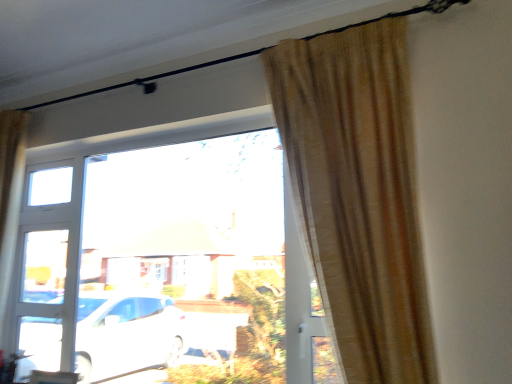
Question: Does transparent glass window at center have a smaller size compared to beige textured curtain at right?

Choices:
 (A) no
 (B) yes

Answer: (B)

Question: Can you confirm if transparent glass window at center is positioned to the right of beige textured curtain at right?

Choices:
 (A) yes
 (B) no

Answer: (B)

Question: Is transparent glass window at center at the left side of beige textured curtain at right?

Choices:
 (A) no
 (B) yes

Answer: (B)

Question: Considering the relative sizes of transparent glass window at center and beige textured curtain at right in the image provided, is transparent glass window at center taller than beige textured curtain at right?

Choices:
 (A) yes
 (B) no

Answer: (A)

Question: Can you confirm if transparent glass window at center is bigger than beige textured curtain at right?

Choices:
 (A) no
 (B) yes

Answer: (A)

Question: Is transparent glass window at center with beige textured curtain at right?

Choices:
 (A) yes
 (B) no

Answer: (B)

Question: Can we say beige textured curtain at right lies outside transparent glass window at center?

Choices:
 (A) no
 (B) yes

Answer: (B)

Question: Considering the relative sizes of beige textured curtain at right and transparent glass window at center in the image provided, is beige textured curtain at right smaller than transparent glass window at center?

Choices:
 (A) yes
 (B) no

Answer: (B)

Question: From the image's perspective, is beige textured curtain at right beneath transparent glass window at center?

Choices:
 (A) no
 (B) yes

Answer: (A)

Question: Is beige textured curtain at right positioned with its back to transparent glass window at center?

Choices:
 (A) yes
 (B) no

Answer: (B)

Question: Does beige textured curtain at right have a lesser height compared to transparent glass window at center?

Choices:
 (A) yes
 (B) no

Answer: (A)

Question: From a real-world perspective, is beige textured curtain at right located higher than transparent glass window at center?

Choices:
 (A) no
 (B) yes

Answer: (B)

Question: Looking at the image, does transparent glass window at center seem bigger or smaller compared to beige textured curtain at right?

Choices:
 (A) small
 (B) big

Answer: (A)